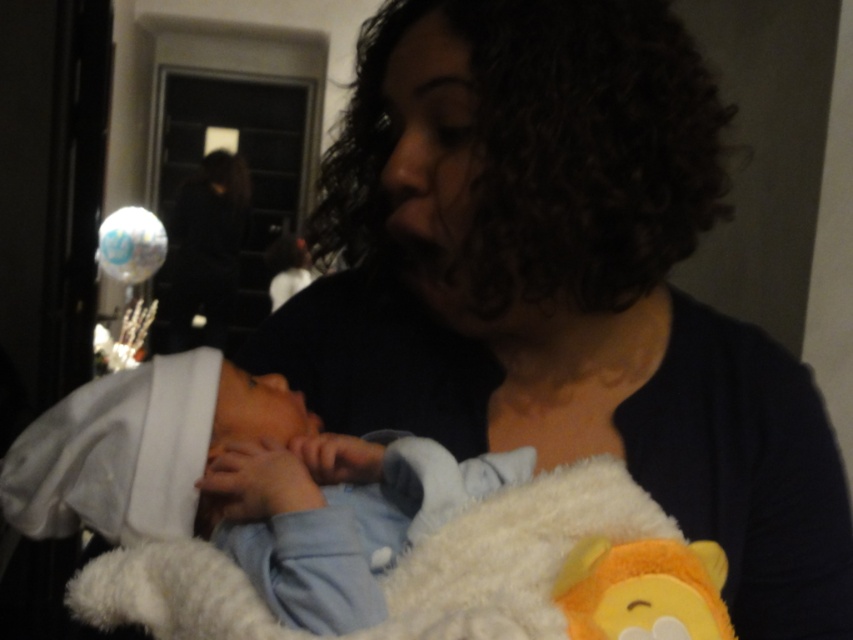
You are a photographer setting up a shot of the scene described. You need to ensure that the white soft blanket at center and the fluffy yellow bear at lower center are both in frame. Given their sizes, which object requires more space horizontally to capture fully?

The white soft blanket at center requires more horizontal space because its width surpasses that of the fluffy yellow bear at lower center.

You are a photographer standing 20 inches away from the camera. You want to take a photo of the white soft blanket at center. Can you adjust your position so that you are exactly 20.47 inches away from the blanket?

Yes, you can move closer by 0.47 inches to be exactly 20.47 inches away from the white soft blanket at center.